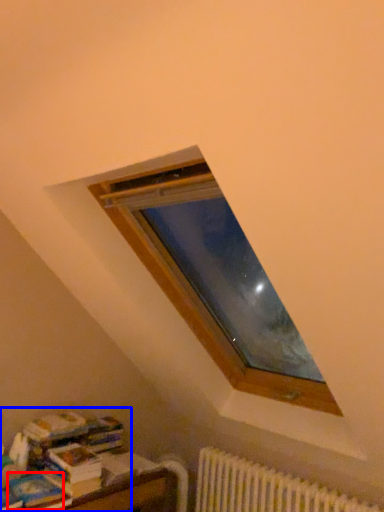
Question: Which of the following is the closest to the observer, paperback book (highlighted by a red box) or book (highlighted by a blue box)?

Choices:
 (A) paperback book
 (B) book

Answer: (A)